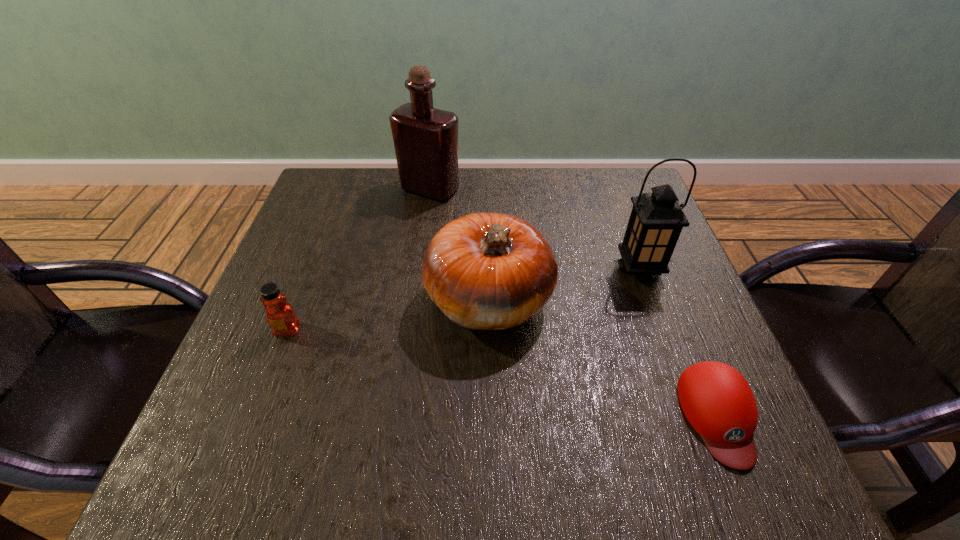
Locate an element on the screen. The image size is (960, 540). free spot at the far left corner of the desktop is located at coordinates (341, 177).

The width and height of the screenshot is (960, 540). What are the coordinates of `vacant region at the far right corner of the desktop` in the screenshot? It's located at (588, 190).

At what (x,y) coordinates should I click in order to perform the action: click on free spot between the lantern and the shortest object. Please return your answer as a coordinate pair (x, y). Looking at the image, I should click on (679, 343).

Locate an element on the screen. blank region between the lantern and the shortest object is located at coordinates pos(679,343).

Locate an element on the screen. free point between the third tallest object and the fourth tallest object is located at coordinates (389, 315).

Locate an element on the screen. vacant space that is in between the third tallest object and the lantern is located at coordinates (564, 285).

You are a GUI agent. You are given a task and a screenshot of the screen. Output one action in this format:
    pyautogui.click(x=<x>, y=<y>)
    Task: Click on the free space that is in between the fourth shortest object and the baseball cap
    
    Given the screenshot: What is the action you would take?
    pyautogui.click(x=679, y=343)

Where is `blank region between the third tallest object and the second shortest object`? This screenshot has height=540, width=960. blank region between the third tallest object and the second shortest object is located at coordinates click(x=389, y=315).

The image size is (960, 540). In order to click on free space that is in between the leftmost object and the third tallest object in this screenshot , I will do `click(389, 315)`.

Identify the location of vacant space in between the fourth tallest object and the third tallest object. (x=389, y=315).